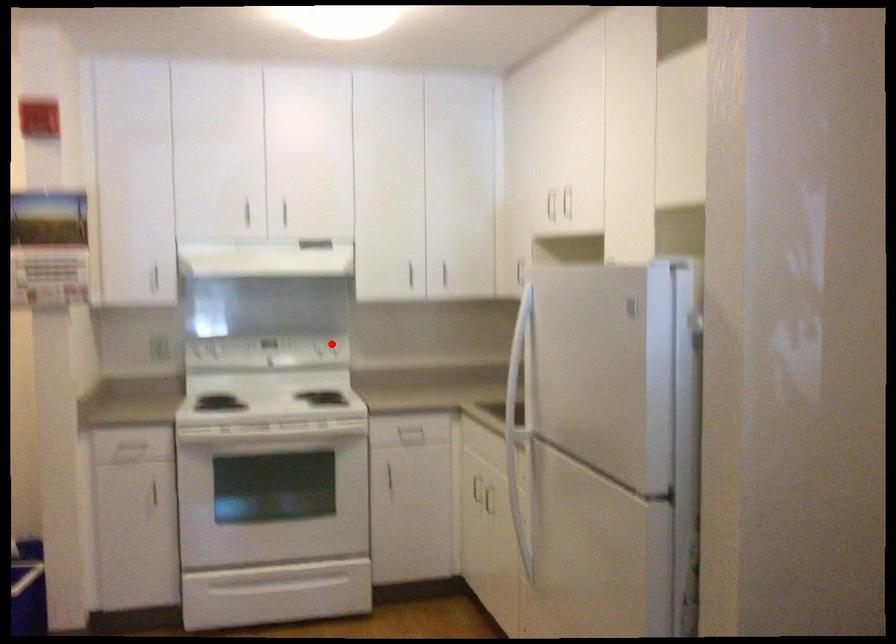
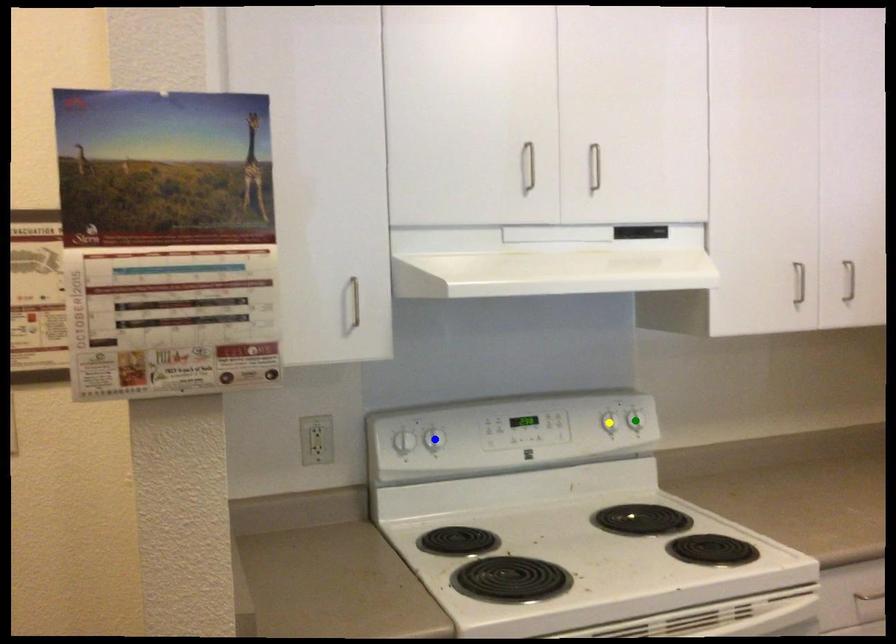
Question: I am providing you with two images of the same scene from different viewpoints. A red point is marked on the first image. You are given multiple points on the second image. Which point in image 2 represents the same 3d spot as the red point in image 1?

Choices:
 (A) green point
 (B) blue point
 (C) yellow point

Answer: (A)